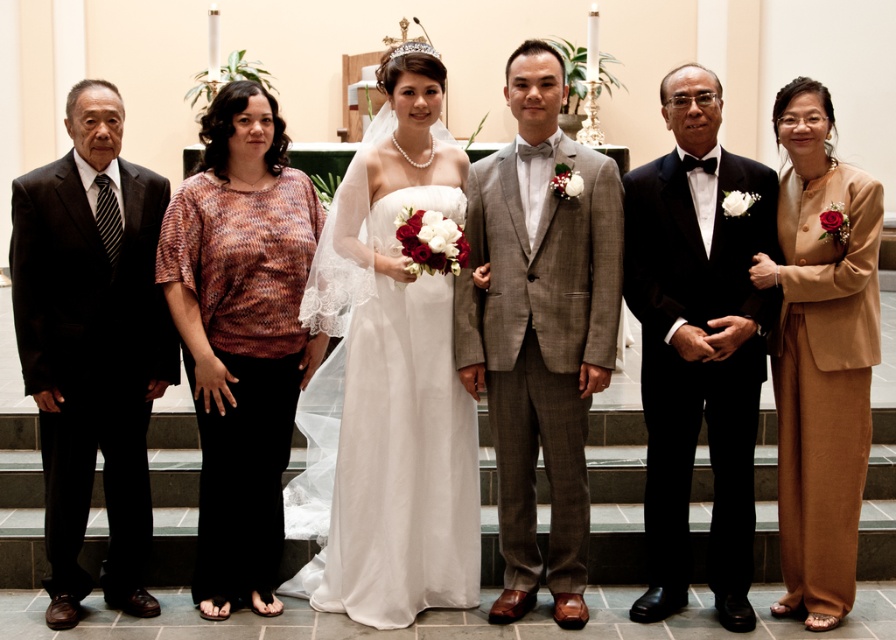
You are a photographer trying to adjust the lighting for the couple in the center. Since the gray textured suit at center and the black satin tuxedo at center are both in the frame, which one might require more light to ensure it doesn not appear too dark in the photo?

The black satin tuxedo at center might require more light because darker colors like black often need additional lighting to avoid appearing too dark in photographs.

You are a photographer adjusting the lighting for the wedding photo. You need to ensure that the black satin tuxedo at center and the tan fabric suit at right are evenly lit. Given their distance apart, can you estimate whether the lighting setup will require adjustment to cover both subjects adequately?

The black satin tuxedo at center is 12.77 inches away from the tan fabric suit at right. Since the distance between them is relatively small, the lighting setup should be able to cover both subjects adequately without needing major adjustments.